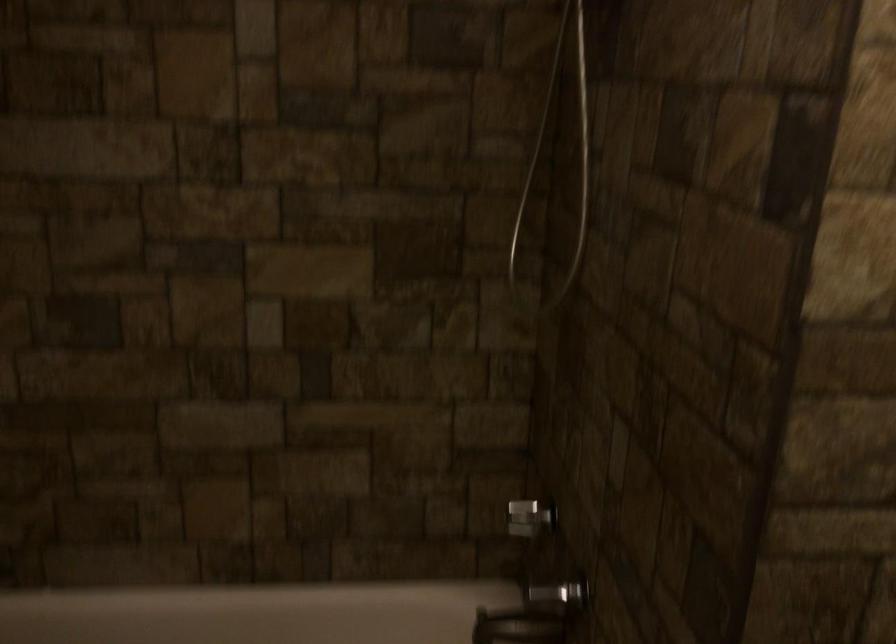
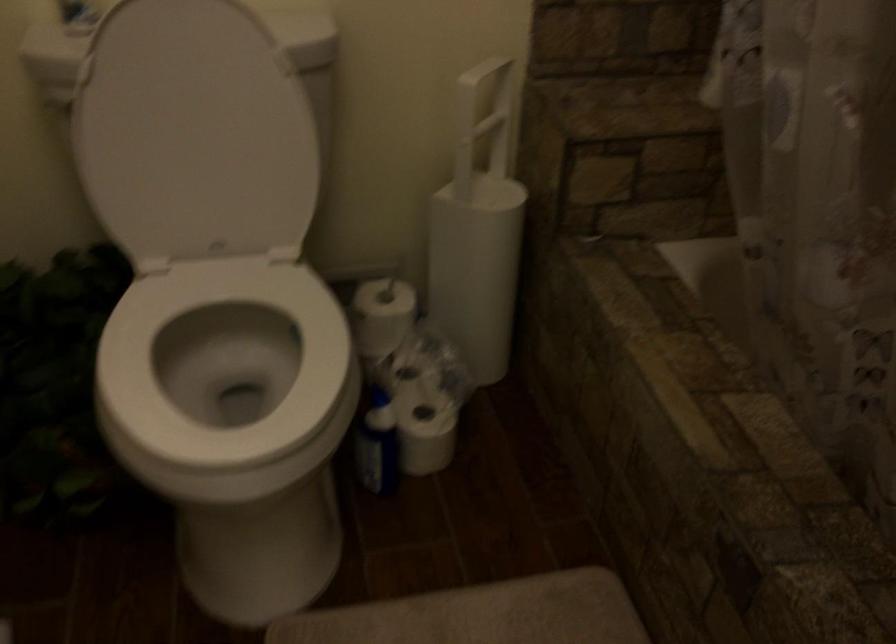
First-person continuous shooting, in which direction is the camera rotating?

The camera rotated toward left-down.